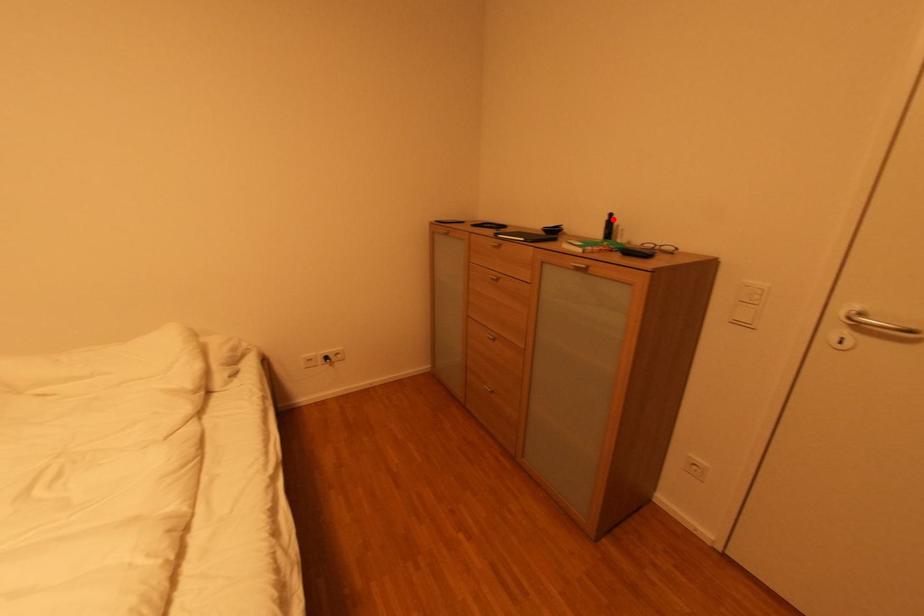
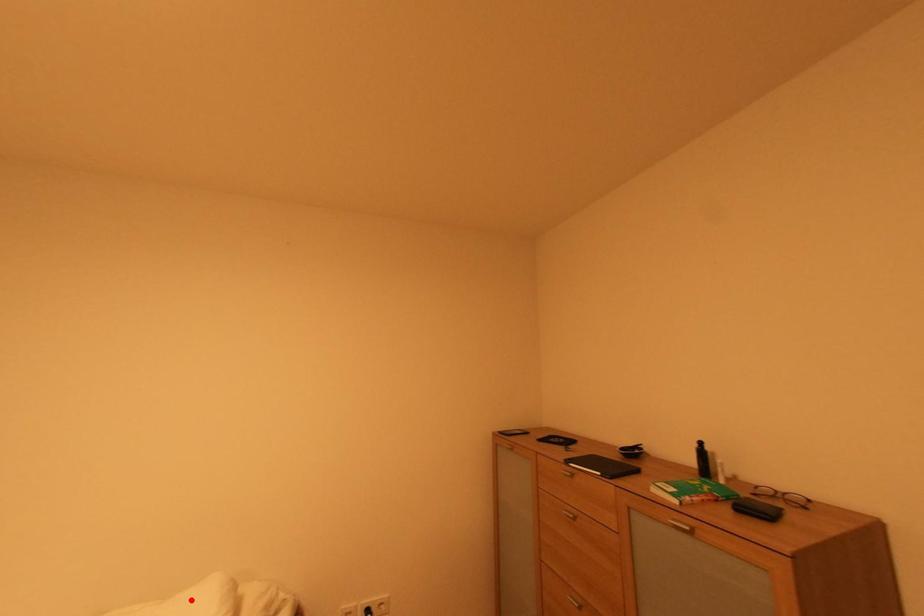
I am providing you with two images of the same scene from different viewpoints. A red point is marked on the first image and another point is marked on the second image. Does the point marked in image1 correspond to the same location as the one in image2?

No